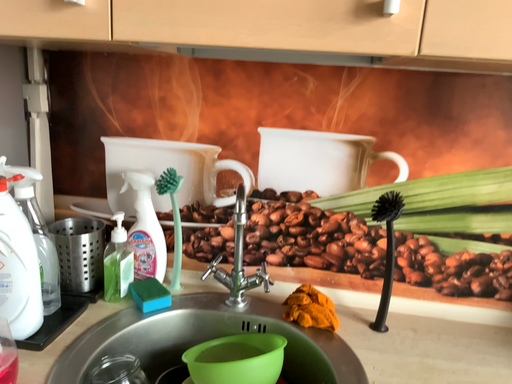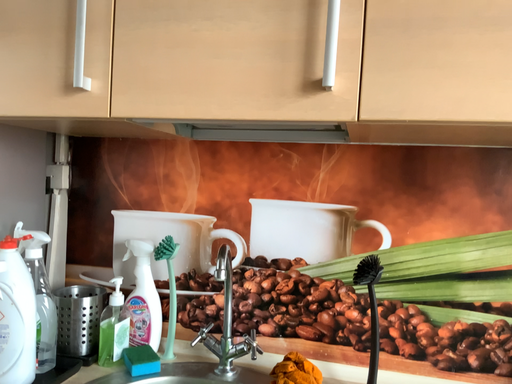
Question: How did the camera likely rotate when shooting the video?

Choices:
 (A) rotated upward
 (B) rotated downward

Answer: (A)